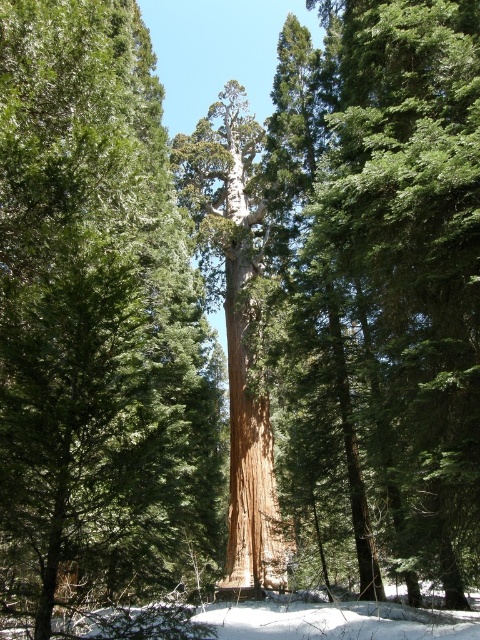
Does point (0, 369) lie in front of point (236, 305)?

Yes, point (0, 369) is closer to viewer.

Does point (166, 620) come closer to viewer compared to point (240, 161)?

Yes, it is in front of point (240, 161).

I want to click on smooth brown trunk at center, so click(97, 326).

Can you confirm if smooth brown tree trunk at center is positioned to the right of rough bark tree at center?

Yes, smooth brown tree trunk at center is to the right of rough bark tree at center.

Which of these two, smooth brown tree trunk at center or rough bark tree at center, stands shorter?

smooth brown tree trunk at center

Which is in front, point (418, 88) or point (254, 378)?

Point (418, 88) is in front.

Where is `smooth brown tree trunk at center`? smooth brown tree trunk at center is located at coordinates (412, 256).

Does smooth brown trunk at center appear over smooth brown tree trunk at center?

Actually, smooth brown trunk at center is below smooth brown tree trunk at center.

Measure the distance between smooth brown trunk at center and smooth brown tree trunk at center.

They are 4.98 meters apart.

The width and height of the screenshot is (480, 640). Identify the location of smooth brown trunk at center. (97, 326).

The image size is (480, 640). Find the location of `smooth brown trunk at center`. smooth brown trunk at center is located at coordinates (97, 326).